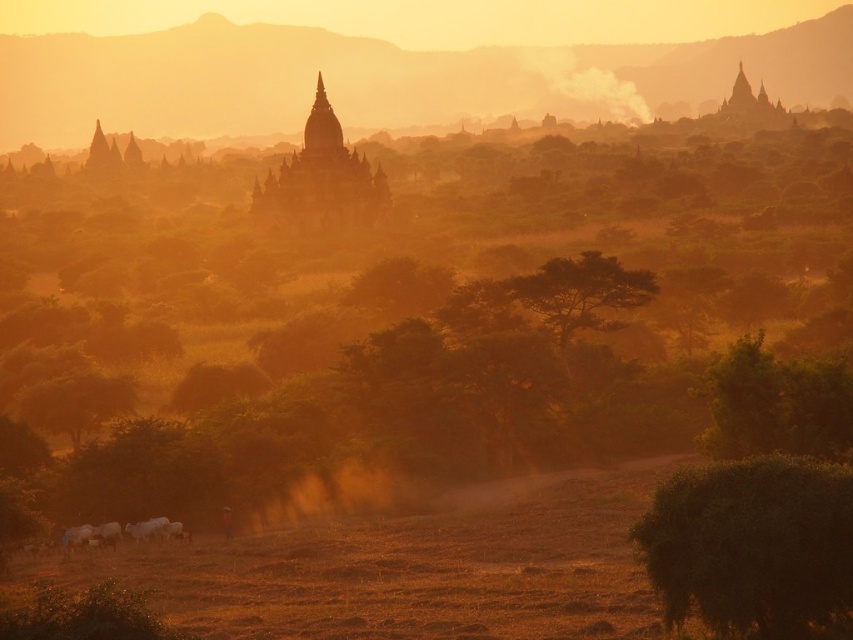
Between foggy haze at upper center and matte orange temple at center, which one appears on the right side from the viewer's perspective?

Positioned to the right is foggy haze at upper center.

Which is behind, point (180, 136) or point (358, 176)?

Positioned behind is point (180, 136).

Is point (62, 134) less distant than point (341, 196)?

No.

Locate an element on the screen. Image resolution: width=853 pixels, height=640 pixels. foggy haze at upper center is located at coordinates (380, 80).

Is point (752, 522) positioned in front of point (840, 372)?

Yes.

Does green fuzzy bush at lower right appear over green leafy tree at center right?

No, green fuzzy bush at lower right is not above green leafy tree at center right.

This screenshot has height=640, width=853. Describe the element at coordinates (751, 545) in the screenshot. I see `green fuzzy bush at lower right` at that location.

This screenshot has height=640, width=853. Find the location of `green fuzzy bush at lower right`. green fuzzy bush at lower right is located at coordinates (751, 545).

What are the coordinates of `matte orange temple at center` in the screenshot? It's located at (321, 179).

Where is `matte orange temple at center`? matte orange temple at center is located at coordinates (321, 179).